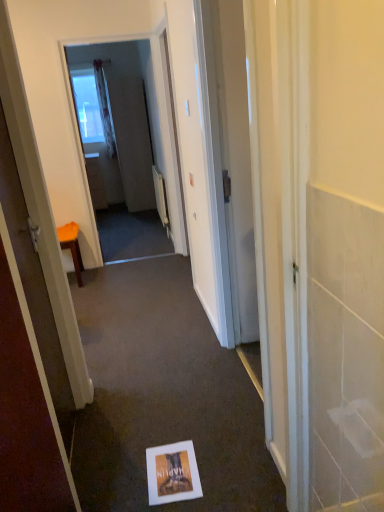
Question: From their relative heights in the image, would you say orange fabric stool at left is taller or shorter than matte gray screen door at center, acting as the second screen door starting from the front?

Choices:
 (A) tall
 (B) short

Answer: (B)

Question: Is orange fabric stool at left in front of or behind matte gray screen door at center, acting as the second screen door starting from the front, in the image?

Choices:
 (A) behind
 (B) front

Answer: (B)

Question: Which is nearer to the orange fabric stool at left?

Choices:
 (A) matte cardboard postcard at center
 (B) matte white screen door at upper center, the 1th screen door from the front
 (C) matte gray screen door at center, acting as the second screen door starting from the front

Answer: (B)

Question: Which is nearer to the matte cardboard postcard at center?

Choices:
 (A) matte gray screen door at center, which is the first screen door in back-to-front order
 (B) orange fabric stool at left
 (C) matte white screen door at upper center, the second screen door from the back

Answer: (B)